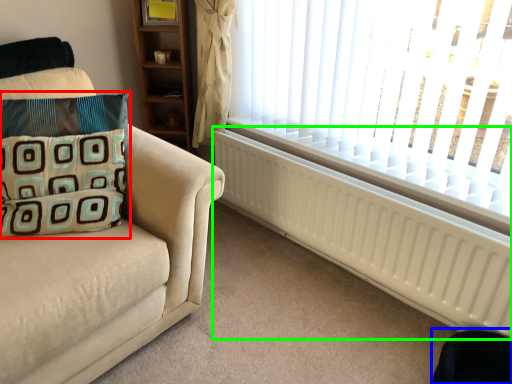
Question: Estimate the real-world distances between objects in this image. Which object is closer to pillow (highlighted by a red box), swivel chair (highlighted by a blue box) or radiator (highlighted by a green box)?

Choices:
 (A) swivel chair
 (B) radiator

Answer: (B)